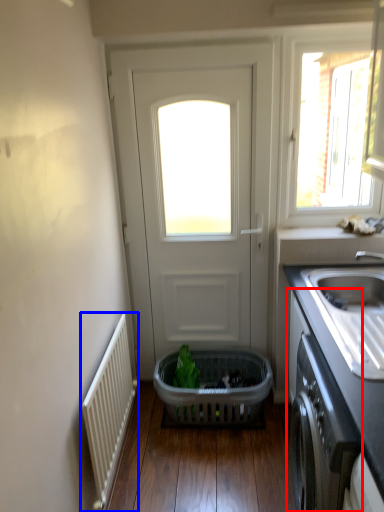
Question: Which object is further to the camera taking this photo, cabinetry (highlighted by a red box) or radiator (highlighted by a blue box)?

Choices:
 (A) cabinetry
 (B) radiator

Answer: (B)